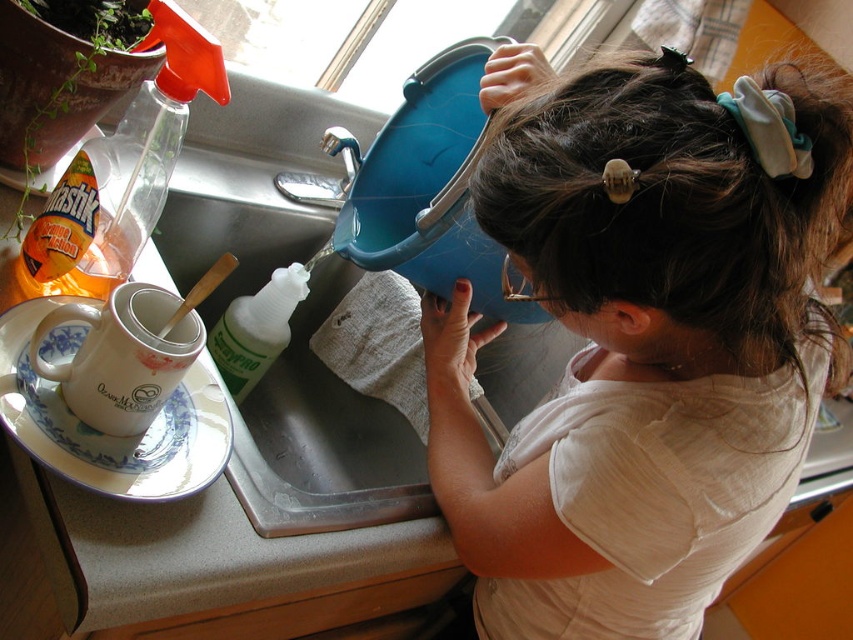
Looking at this image, you are a cleaning robot in the kitchen. You need to clean the white ceramic plate at upper left and the light brown hair at upper right. Which object should you clean first based on their positions?

You should clean the light brown hair at upper right first because it is closer to you than the white ceramic plate at upper left.

You are a home inspector evaluating the kitchen layout. You notice the light brown hair at upper right and the white ceramic plate at upper left. Which object is positioned lower in the image?

The light brown hair at upper right is positioned lower than the white ceramic plate at upper left in the image.

You are a home assistant and need to determine if the light brown hair at upper right can be covered by a white ceramic plate at upper left when placed over it. Based on their sizes, what would you conclude?

Answer: The light brown hair at upper right is larger in size than the white ceramic plate at upper left, so the plate cannot fully cover the hair.